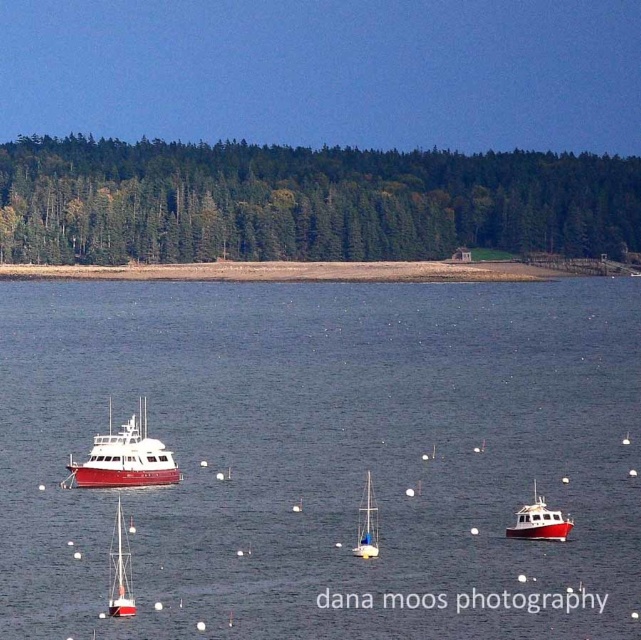
The image size is (641, 640). Describe the element at coordinates (322, 452) in the screenshot. I see `smooth water at center` at that location.

Can you confirm if smooth water at center is smaller than white matte boat at center-right?

No.

Describe the element at coordinates (322, 452) in the screenshot. I see `smooth water at center` at that location.

The width and height of the screenshot is (641, 640). In order to click on smooth water at center in this screenshot , I will do `click(322, 452)`.

Between red matte boat at center and white matte boat at center-right, which one appears on the right side from the viewer's perspective?

white matte boat at center-right

In the scene shown: Does red matte boat at center have a greater width compared to white matte boat at center-right?

Indeed, red matte boat at center has a greater width compared to white matte boat at center-right.

Who is more distant from viewer, (108, 460) or (526, 515)?

Point (108, 460)

You are a GUI agent. You are given a task and a screenshot of the screen. Output one action in this format:
    pyautogui.click(x=<x>, y=<y>)
    Task: Click on the red matte boat at center
    This screenshot has width=641, height=640.
    Given the screenshot: What is the action you would take?
    pyautogui.click(x=124, y=458)

Does smooth water at center have a smaller size compared to white matte sailboat at lower left?

No, smooth water at center is not smaller than white matte sailboat at lower left.

Which is below, smooth water at center or white matte sailboat at lower left?

white matte sailboat at lower left is below.

Which is in front, point (422, 326) or point (112, 566)?

Point (112, 566) is in front.

Image resolution: width=641 pixels, height=640 pixels. In order to click on smooth water at center in this screenshot , I will do `click(322, 452)`.